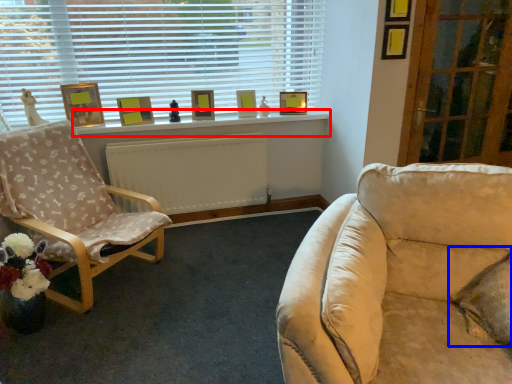
Question: Which object appears closest to the camera in this image, window sill (highlighted by a red box) or pillow (highlighted by a blue box)?

Choices:
 (A) window sill
 (B) pillow

Answer: (B)